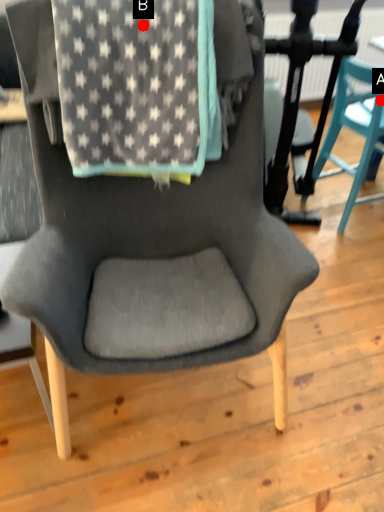
Question: Two points are circled on the image, labeled by A and B beside each circle. Which point is closer to the camera?

Choices:
 (A) A is closer
 (B) B is closer

Answer: (B)